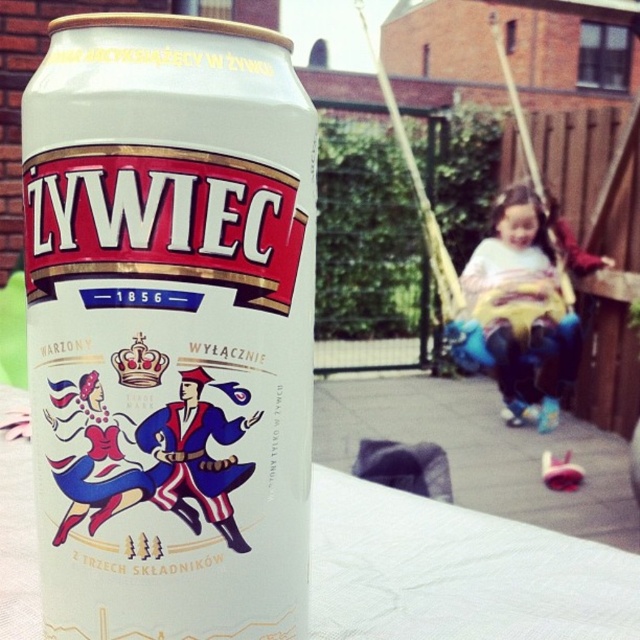
Question: Can you confirm if white matte beer can at center is thinner than light blue denim jeans at lower right?

Choices:
 (A) no
 (B) yes

Answer: (B)

Question: Does white matte beer can at center have a lesser width compared to light blue denim jeans at lower right?

Choices:
 (A) yes
 (B) no

Answer: (A)

Question: Observing the image, what is the correct spatial positioning of white matte beer can at center in reference to light blue denim jeans at lower right?

Choices:
 (A) below
 (B) above

Answer: (A)

Question: Which object appears closest to the camera in this image?

Choices:
 (A) light blue denim jeans at lower right
 (B) white matte beer can at center

Answer: (B)

Question: Among these points, which one is nearest to the camera?

Choices:
 (A) (518, 349)
 (B) (129, 428)

Answer: (B)